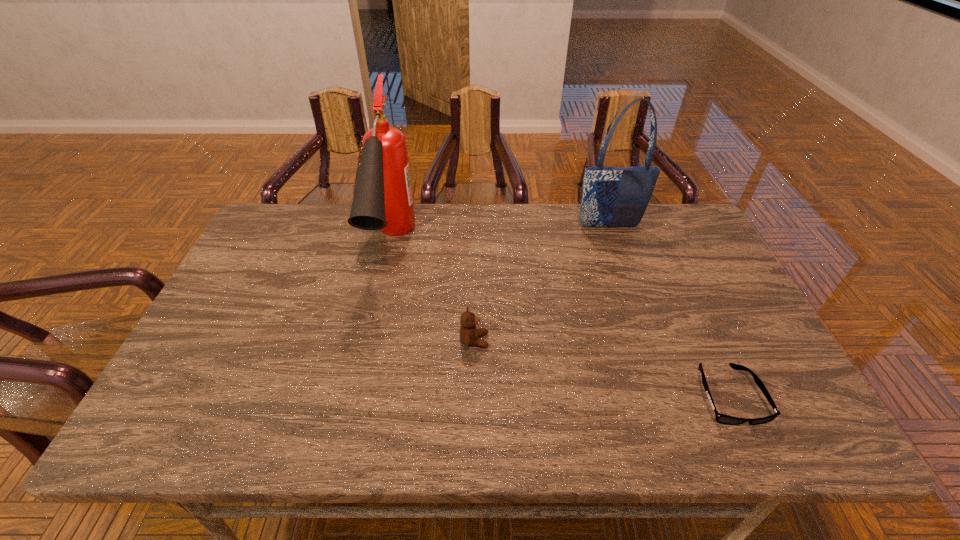
At what (x,y) coordinates should I click in order to perform the action: click on empty space that is in between the second shortest object and the shortest object. Please return your answer as a coordinate pair (x, y). Looking at the image, I should click on (601, 368).

Locate which object ranks in proximity to the sunglasses. Please provide its 2D coordinates. Your answer should be formatted as a tuple, i.e. [(x, y)], where the tuple contains the x and y coordinates of a point satisfying the conditions above.

[(469, 334)]

Where is `object that is the third closest to the shopping bag`? The width and height of the screenshot is (960, 540). object that is the third closest to the shopping bag is located at coordinates (382, 200).

Find the location of a particular element. The height and width of the screenshot is (540, 960). vacant region that satisfies the following two spatial constraints: 1. on the front-facing side of the shopping bag; 2. at the face of the teddy bear is located at coordinates (648, 341).

This screenshot has height=540, width=960. I want to click on vacant space that satisfies the following two spatial constraints: 1. on the front-facing side of the shopping bag; 2. at the face of the teddy bear, so click(648, 341).

This screenshot has height=540, width=960. Identify the location of vacant space that satisfies the following two spatial constraints: 1. on the front-facing side of the shopping bag; 2. at the face of the teddy bear. (648, 341).

The image size is (960, 540). I want to click on vacant area that satisfies the following two spatial constraints: 1. on the front-facing side of the shopping bag; 2. at the face of the third tallest object, so click(x=648, y=341).

The width and height of the screenshot is (960, 540). What are the coordinates of `free space that satisfies the following two spatial constraints: 1. on the front-facing side of the shopping bag; 2. at the face of the third farthest object` in the screenshot? It's located at (648, 341).

The image size is (960, 540). Find the location of `free space in the image that satisfies the following two spatial constraints: 1. on the front-facing side of the shopping bag; 2. at the face of the second object from left to right`. free space in the image that satisfies the following two spatial constraints: 1. on the front-facing side of the shopping bag; 2. at the face of the second object from left to right is located at coordinates (648, 341).